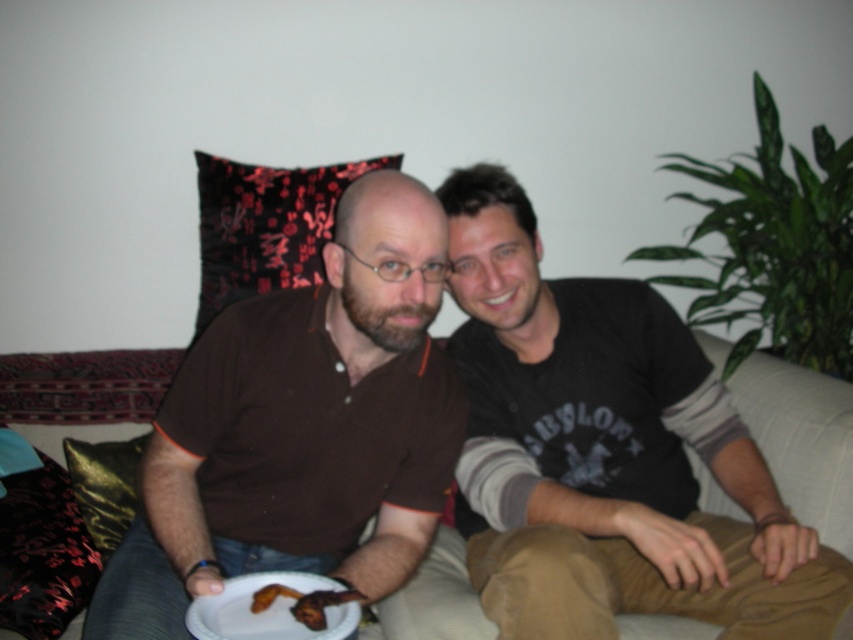
Question: Is the position of brown cotton shirt at center more distant than that of gold shiny pillow at lower left?

Choices:
 (A) no
 (B) yes

Answer: (A)

Question: Among these objects, which one is farthest from the camera?

Choices:
 (A) white paper plate at lower center
 (B) brown matte shirt at center

Answer: (B)

Question: Observing the image, what is the correct spatial positioning of brown cotton shirt at center in reference to brown crispy fried food at lower center?

Choices:
 (A) below
 (B) above

Answer: (B)

Question: Which of these objects is positioned farthest from the brown crispy fried food at lower center?

Choices:
 (A) gold shiny pillow at lower left
 (B) black velvet pillow at upper center

Answer: (B)

Question: Does brown cotton shirt at center have a lesser width compared to black velvet pillow at upper center?

Choices:
 (A) no
 (B) yes

Answer: (A)

Question: Which is farther from the brown crispy fried food at lower center?

Choices:
 (A) black velvet pillow at upper center
 (B) white paper plate at lower center
 (C) brown matte shirt at center

Answer: (A)